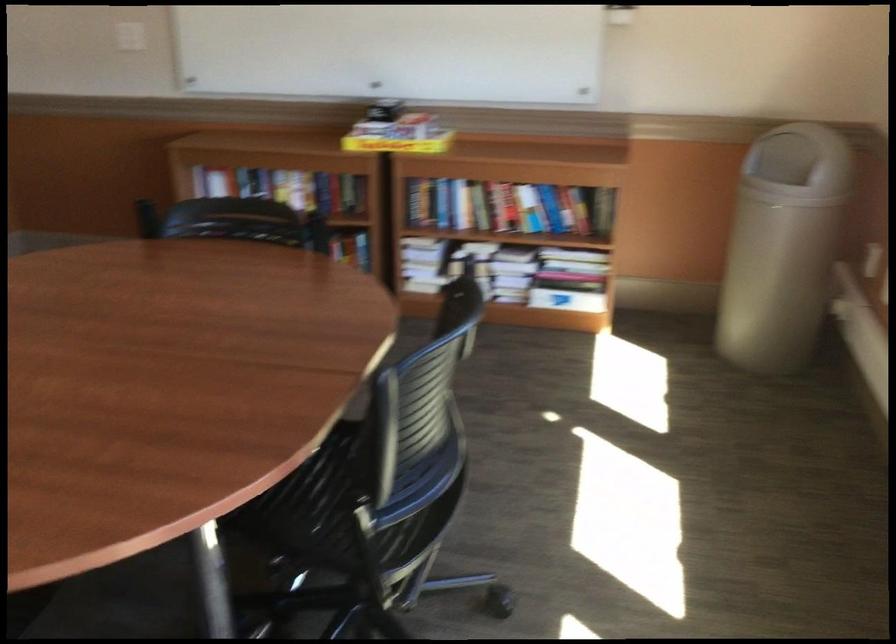
Where would you push the trash can lid? Please return your answer as a coordinate pair (x, y).

(798, 156)